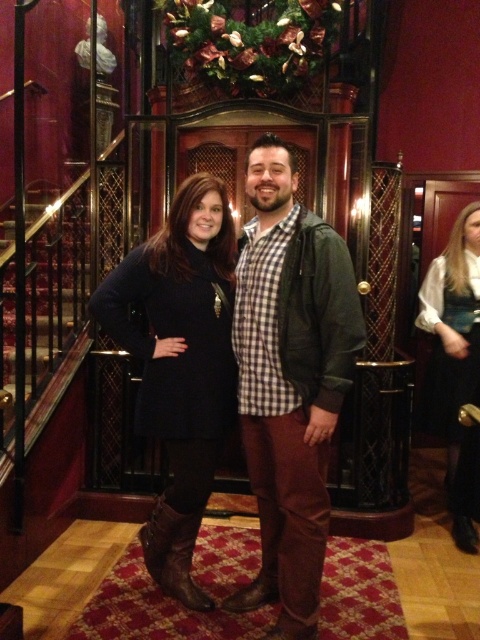
You are standing in the upscale setting described in the scene. You need to locate the green matte jacket at center. Based on its 2D coordinates, where would you look first?

The green matte jacket at center is located at the 2D coordinates point (289, 381), so you should look towards the center of the image slightly to the right and above the midpoint.

You are a photographer setting up a shoot in this upscale indoor location. You need to place a small prop between the black satin dress at right and the brown leather boot at lower center. Based on their positions, which object should the prop be closer to?

The black satin dress at right is closer to the viewer than the brown leather boot at lower center, so the prop should be placed closer to the black satin dress at right to maintain visual balance.

You are a photographer setting up for a photoshoot in this upscale indoor setting. You need to ensure that the black satin dress at right and the brown leather boot at lower center are both visible in the frame. Given their sizes, which object should you focus on first to ensure proper framing?

The black satin dress at right has a larger size compared to the brown leather boot at lower center, so you should focus on framing the black satin dress at right first to accommodate its larger size in the composition.